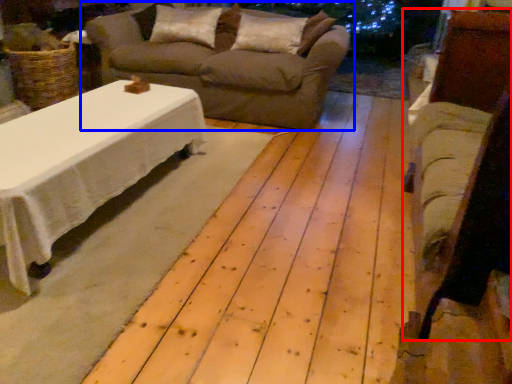
Question: Among these objects, which one is nearest to the camera, armchair (highlighted by a red box) or studio couch (highlighted by a blue box)?

Choices:
 (A) armchair
 (B) studio couch

Answer: (A)